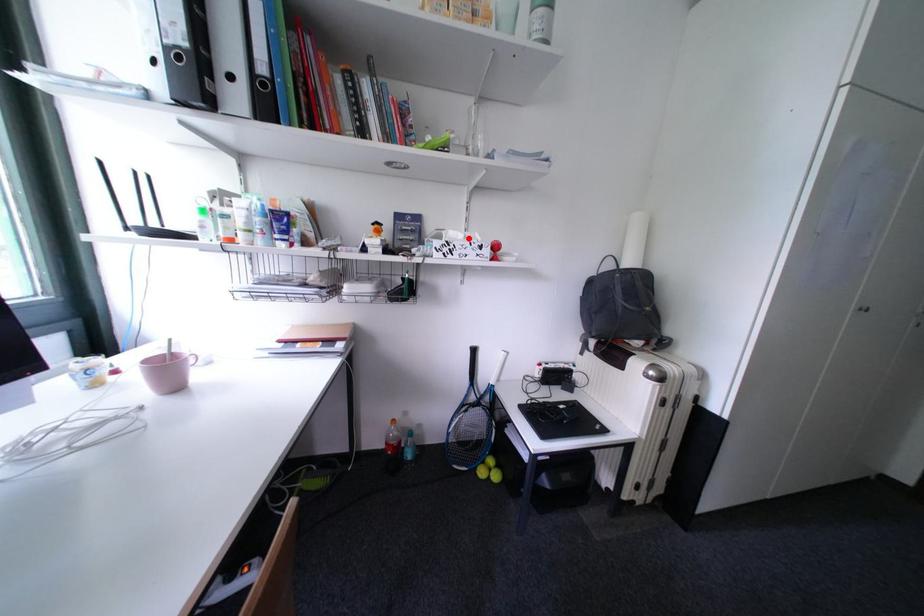
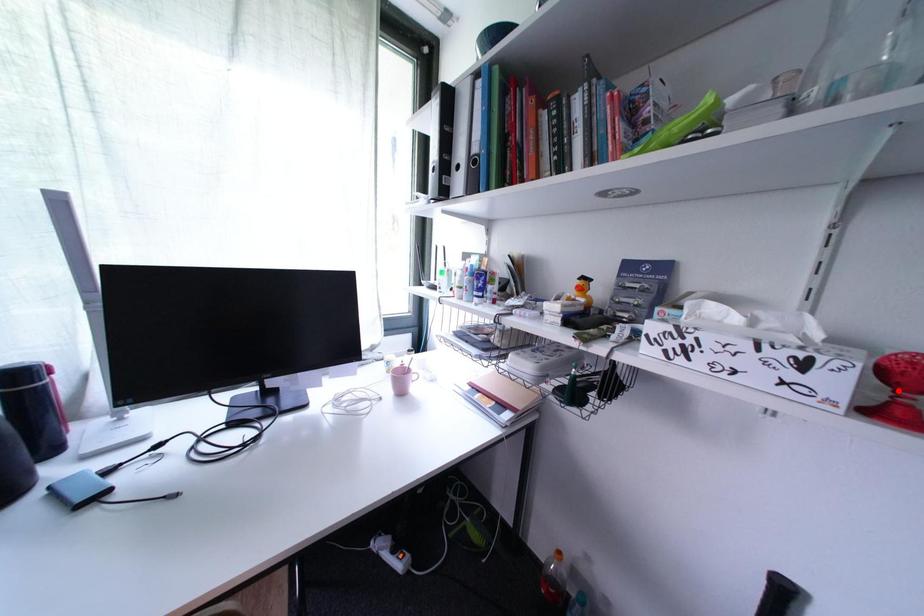
I am providing you with two images of the same scene from different viewpoints. A red point is marked on the first image and another point is marked on the second image. Is the red point in image1 aligned with the point shown in image2?

No